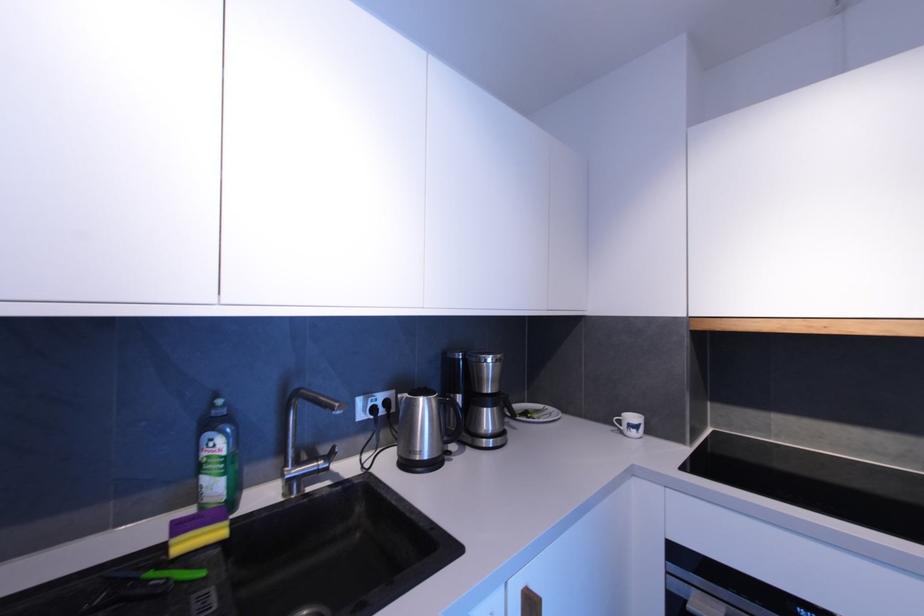
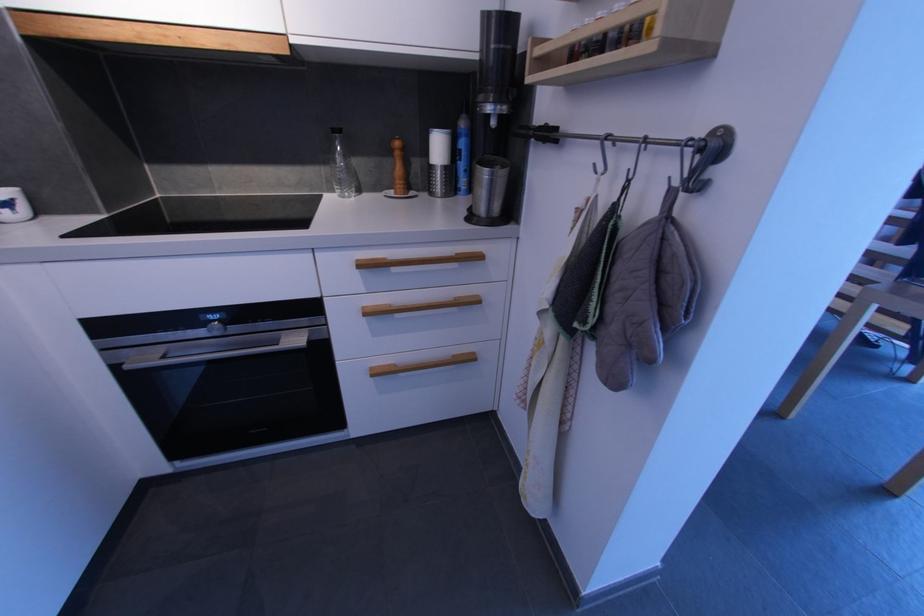
The first image is from the beginning of the video and the second image is from the end. How did the camera likely rotate when shooting the video?

The camera's rotation is toward right-down.